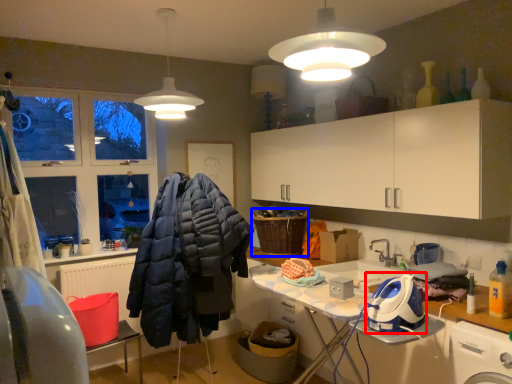
Question: Among these objects, which one is nearest to the camera, appliance (highlighted by a red box) or basket (highlighted by a blue box)?

Choices:
 (A) appliance
 (B) basket

Answer: (A)